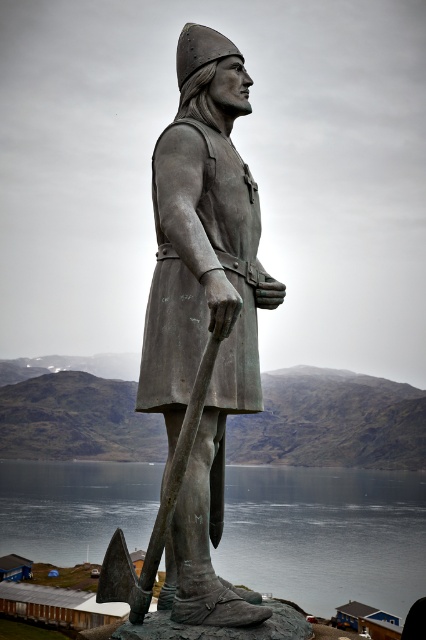
Is greenish-blue water at lower center smaller than bronze textured axe at center?

No, greenish-blue water at lower center is not smaller than bronze textured axe at center.

Who is shorter, greenish-blue water at lower center or bronze textured axe at center?

With less height is bronze textured axe at center.

Image resolution: width=426 pixels, height=640 pixels. I want to click on greenish-blue water at lower center, so click(x=325, y=536).

At what (x,y) coordinates should I click in order to perform the action: click on greenish-blue water at lower center. Please return your answer as a coordinate pair (x, y). The height and width of the screenshot is (640, 426). Looking at the image, I should click on (325, 536).

Is bronze statue at center to the right of bronze textured axe at center from the viewer's perspective?

Correct, you'll find bronze statue at center to the right of bronze textured axe at center.

Image resolution: width=426 pixels, height=640 pixels. I want to click on bronze statue at center, so click(204, 310).

You are a GUI agent. You are given a task and a screenshot of the screen. Output one action in this format:
    pyautogui.click(x=<x>, y=<y>)
    Task: Click on the bronze statue at center
    
    Given the screenshot: What is the action you would take?
    pyautogui.click(x=204, y=310)

Who is shorter, bronze statue at center or greenish-blue water at lower center?

bronze statue at center is shorter.

Can you confirm if bronze statue at center is positioned to the right of greenish-blue water at lower center?

Correct, you'll find bronze statue at center to the right of greenish-blue water at lower center.

Between point (221, 180) and point (417, 508), which one is positioned behind?

The point (417, 508) is behind.

You are a GUI agent. You are given a task and a screenshot of the screen. Output one action in this format:
    pyautogui.click(x=<x>, y=<y>)
    Task: Click on the bronze statue at center
    Image resolution: width=426 pixels, height=640 pixels.
    Given the screenshot: What is the action you would take?
    pyautogui.click(x=204, y=310)